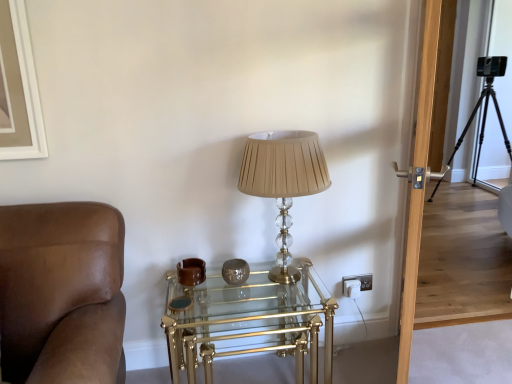
Question: From a real-world perspective, is transparent wooden door at right beneath black metal tripod at right?

Choices:
 (A) no
 (B) yes

Answer: (A)

Question: Is transparent wooden door at right looking in the opposite direction of black metal tripod at right?

Choices:
 (A) yes
 (B) no

Answer: (B)

Question: From the image's perspective, would you say transparent wooden door at right is shown under black metal tripod at right?

Choices:
 (A) no
 (B) yes

Answer: (B)

Question: Could you tell me if transparent wooden door at right is facing black metal tripod at right?

Choices:
 (A) no
 (B) yes

Answer: (A)

Question: Is transparent wooden door at right positioned beyond the bounds of black metal tripod at right?

Choices:
 (A) yes
 (B) no

Answer: (A)

Question: From the image's perspective, relative to clear glass/golden metal table at center, is black metal tripod at right above or below?

Choices:
 (A) below
 (B) above

Answer: (B)

Question: From their relative heights in the image, would you say black metal tripod at right is taller or shorter than clear glass/golden metal table at center?

Choices:
 (A) short
 (B) tall

Answer: (B)

Question: From a real-world perspective, is black metal tripod at right physically located above or below clear glass/golden metal table at center?

Choices:
 (A) above
 (B) below

Answer: (A)

Question: Based on their positions, is black metal tripod at right located to the left or right of clear glass/golden metal table at center?

Choices:
 (A) left
 (B) right

Answer: (B)

Question: Considering their positions, is transparent wooden door at right located in front of or behind black metal tripod at right?

Choices:
 (A) front
 (B) behind

Answer: (A)

Question: Looking at the image, does transparent wooden door at right seem bigger or smaller compared to black metal tripod at right?

Choices:
 (A) small
 (B) big

Answer: (A)

Question: Based on their positions, is transparent wooden door at right located to the left or right of black metal tripod at right?

Choices:
 (A) left
 (B) right

Answer: (A)

Question: From a real-world perspective, is transparent wooden door at right physically located above or below black metal tripod at right?

Choices:
 (A) below
 (B) above

Answer: (B)

Question: Considering their positions, is clear glass/golden metal table at center located in front of or behind transparent wooden door at right?

Choices:
 (A) behind
 (B) front

Answer: (A)

Question: From the image's perspective, relative to transparent wooden door at right, is clear glass/golden metal table at center above or below?

Choices:
 (A) below
 (B) above

Answer: (A)